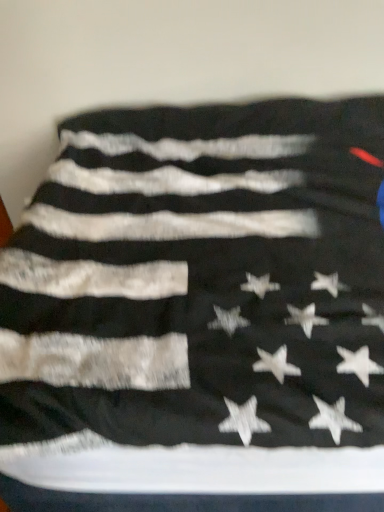
The height and width of the screenshot is (512, 384). Describe the element at coordinates (202, 279) in the screenshot. I see `black fabric flag at center` at that location.

This screenshot has width=384, height=512. What are the coordinates of `black fabric flag at center` in the screenshot? It's located at (202, 279).

Locate an element on the screen. black fabric flag at center is located at coordinates (202, 279).